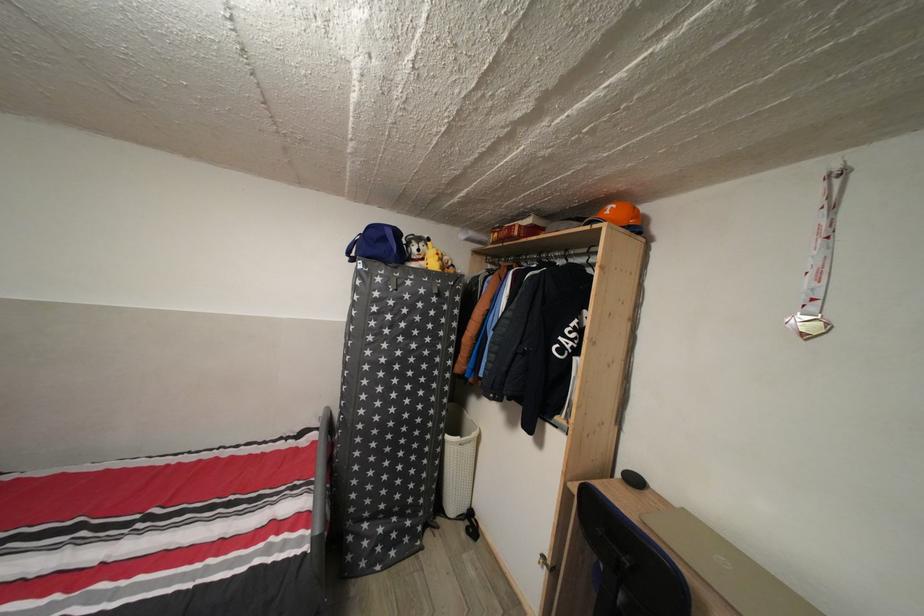
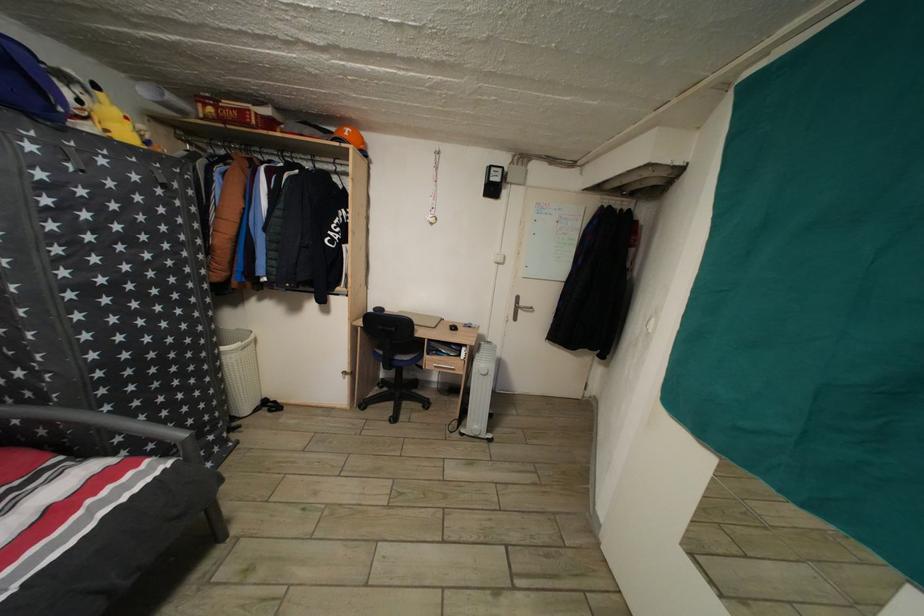
Find the pixel in the second image that matches (x=444, y=261) in the first image.

(134, 124)